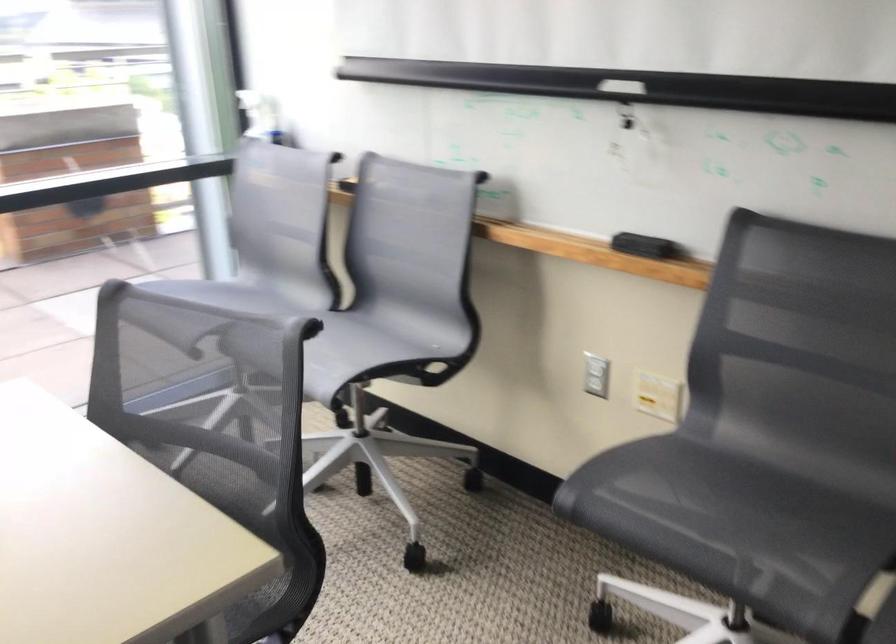
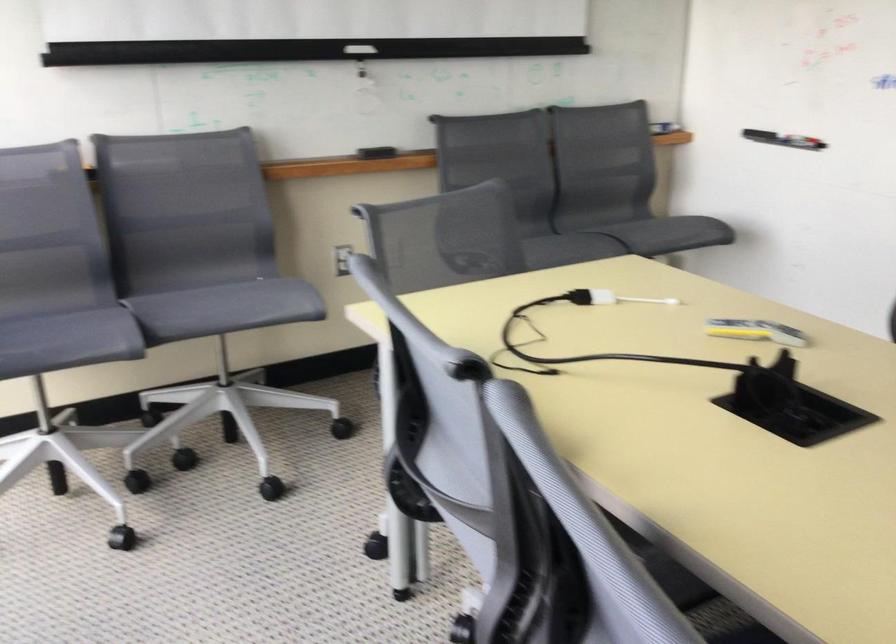
Locate, in the second image, the point that corresponds to (290,297) in the first image.

(58, 305)